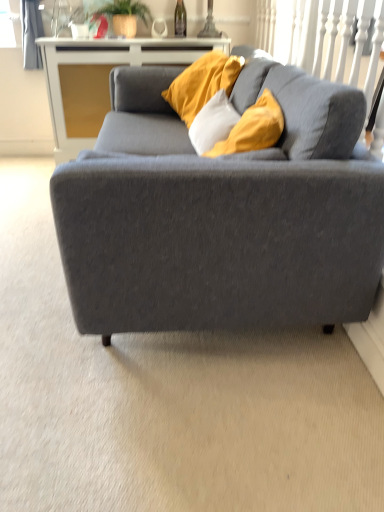
Question: Can we say green glass wine bottle at upper center lies outside matte gray couch at center?

Choices:
 (A) yes
 (B) no

Answer: (A)

Question: Is the position of green glass wine bottle at upper center more distant than that of matte gray couch at center?

Choices:
 (A) no
 (B) yes

Answer: (B)

Question: Considering the relative positions of green glass wine bottle at upper center and matte gray couch at center in the image provided, is green glass wine bottle at upper center in front of matte gray couch at center?

Choices:
 (A) no
 (B) yes

Answer: (A)

Question: Is green glass wine bottle at upper center in contact with matte gray couch at center?

Choices:
 (A) yes
 (B) no

Answer: (B)

Question: From the image's perspective, would you say green glass wine bottle at upper center is shown under matte gray couch at center?

Choices:
 (A) yes
 (B) no

Answer: (B)

Question: Considering the positions of green leafy plant at upper center and matte gray couch at center in the image, is green leafy plant at upper center wider or thinner than matte gray couch at center?

Choices:
 (A) thin
 (B) wide

Answer: (A)

Question: Considering the positions of green leafy plant at upper center and matte gray couch at center in the image, is green leafy plant at upper center taller or shorter than matte gray couch at center?

Choices:
 (A) short
 (B) tall

Answer: (A)

Question: From the image's perspective, relative to matte gray couch at center, is green leafy plant at upper center above or below?

Choices:
 (A) above
 (B) below

Answer: (A)

Question: Is green leafy plant at upper center spatially inside matte gray couch at center, or outside of it?

Choices:
 (A) inside
 (B) outside

Answer: (B)

Question: From the image's perspective, is green glass wine bottle at upper center positioned above or below white glossy cabinet at upper center?

Choices:
 (A) below
 (B) above

Answer: (B)

Question: Is green glass wine bottle at upper center to the left or to the right of white glossy cabinet at upper center in the image?

Choices:
 (A) right
 (B) left

Answer: (A)

Question: Does point pos(178,14) appear closer or farther from the camera than point pos(102,74)?

Choices:
 (A) closer
 (B) farther

Answer: (B)

Question: Is green glass wine bottle at upper center spatially inside white glossy cabinet at upper center, or outside of it?

Choices:
 (A) outside
 (B) inside

Answer: (A)

Question: Is green glass wine bottle at upper center taller or shorter than green leafy plant at upper center?

Choices:
 (A) tall
 (B) short

Answer: (B)

Question: Visually, is green glass wine bottle at upper center positioned to the left or to the right of green leafy plant at upper center?

Choices:
 (A) right
 (B) left

Answer: (A)